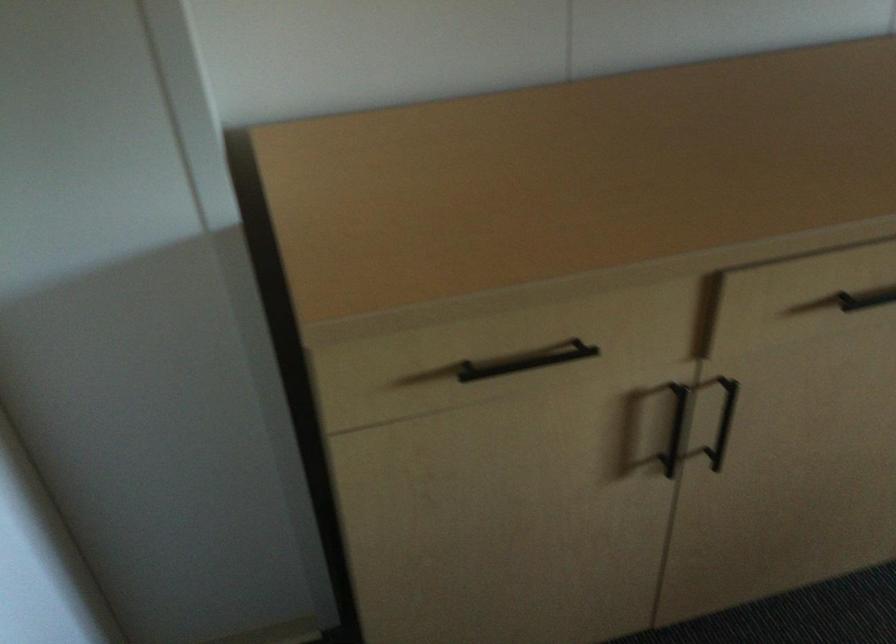
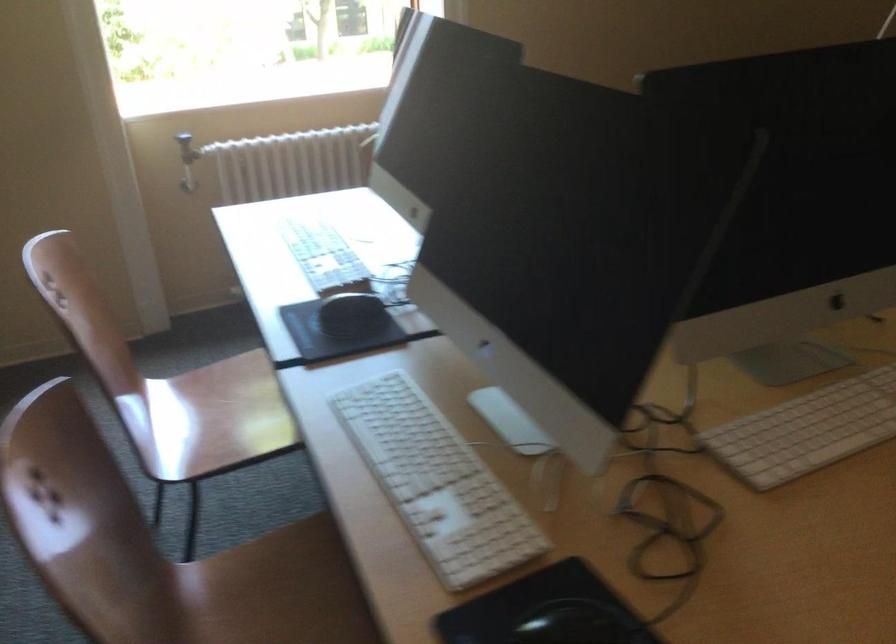
Based on the continuous images, in which direction is the camera rotating?

The camera's rotation is toward right-down.